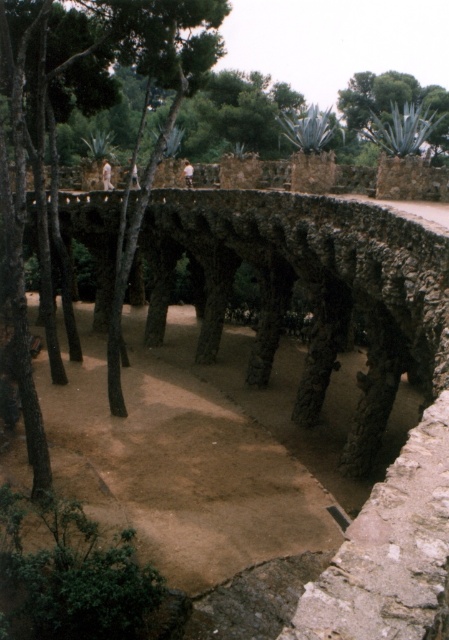
Is point (108, 166) farther from viewer compared to point (185, 182)?

Yes, point (108, 166) is farther from viewer.

Does white matte dress at upper center come in front of white matte shirt at upper center?

No.

Does point (105, 168) come in front of point (188, 182)?

No, it is behind (188, 182).

Image resolution: width=449 pixels, height=640 pixels. Identify the location of white matte dress at upper center. (106, 176).

Does point (322, 392) lie in front of point (183, 172)?

Yes, point (322, 392) is in front of point (183, 172).

Which is in front, point (205, 275) or point (188, 179)?

Point (205, 275) is in front.

The image size is (449, 640). What are the coordinates of `rustic stone bridge at center` in the screenshot? It's located at (321, 289).

Which is in front, point (325, 284) or point (111, 186)?

Point (325, 284) is in front.

Can you confirm if rustic stone bridge at center is bigger than white matte dress at upper center?

Yes.

Is point (372, 372) in front of point (105, 163)?

That is True.

Find the location of a particular element. This screenshot has height=640, width=449. rustic stone bridge at center is located at coordinates (321, 289).